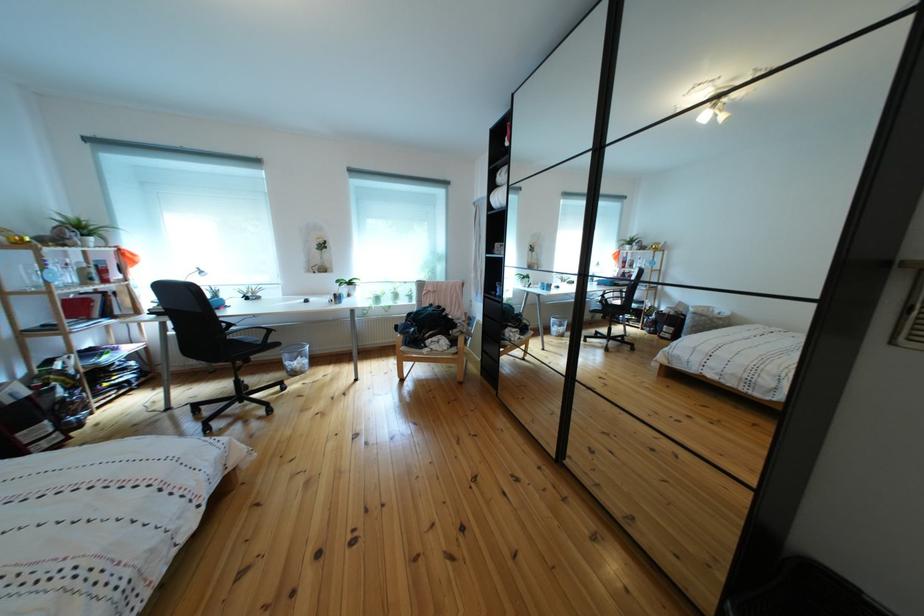
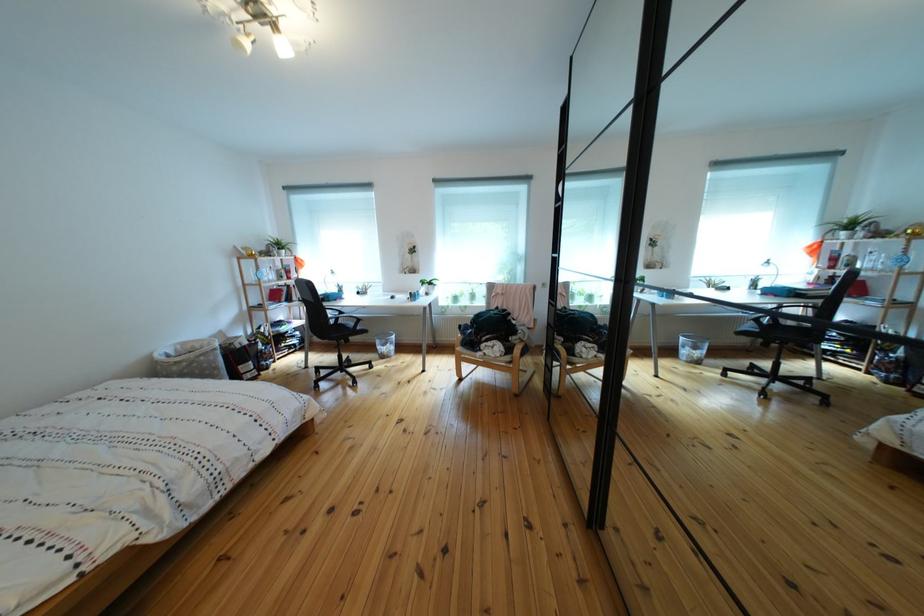
Find the pixel in the second image that matches (x=78, y=292) in the first image.

(282, 286)